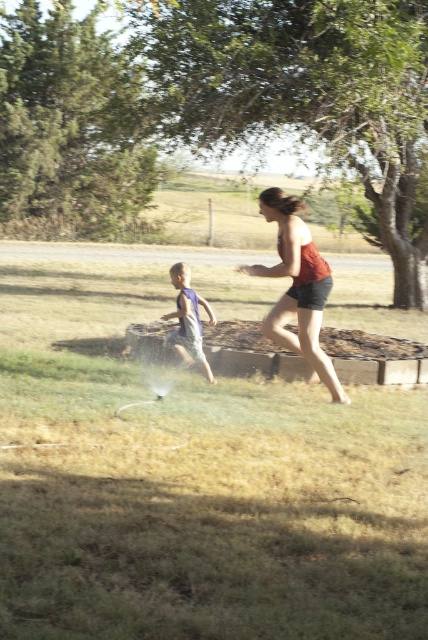
Who is more forward, (315, 248) or (199, 326)?

Point (199, 326) is in front.

Does matte red tank top at center have a lesser width compared to blue cotton shorts at left?

Yes.

Image resolution: width=428 pixels, height=640 pixels. What do you see at coordinates (297, 288) in the screenshot?
I see `matte red tank top at center` at bounding box center [297, 288].

I want to click on matte red tank top at center, so click(x=297, y=288).

Is green grass at center positioned behind matte red tank top at center?

No, it is not.

Who is higher up, green grass at center or matte red tank top at center?

matte red tank top at center is above.

Identify the location of green grass at center. (193, 484).

Image resolution: width=428 pixels, height=640 pixels. In order to click on green grass at center in this screenshot , I will do `click(193, 484)`.

In the scene shown: Is green grass at center to the left of blue cotton shorts at left from the viewer's perspective?

No, green grass at center is not to the left of blue cotton shorts at left.

Is point (324, 515) positioned after point (196, 355)?

No, (324, 515) is in front of (196, 355).

Identify the location of green grass at center. The height and width of the screenshot is (640, 428). (193, 484).